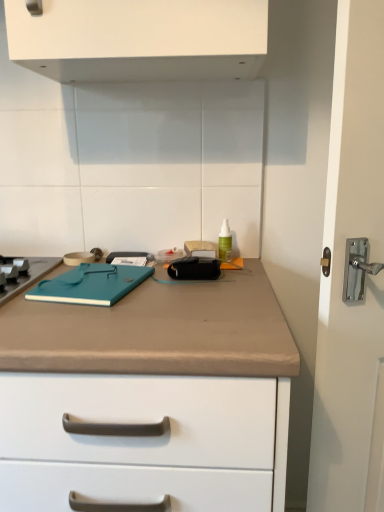
This screenshot has height=512, width=384. Identify the location of unoccupied area in front of green translucent bottle at center. (221, 288).